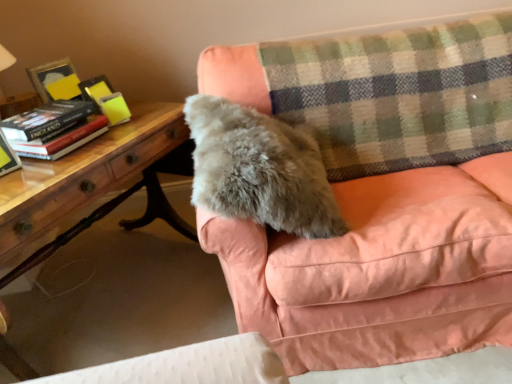
At what (x,y) coordinates should I click in order to perform the action: click on free spot to the right of hardcover book at left. Please return your answer as a coordinate pair (x, y). The height and width of the screenshot is (384, 512). Looking at the image, I should click on (46, 172).